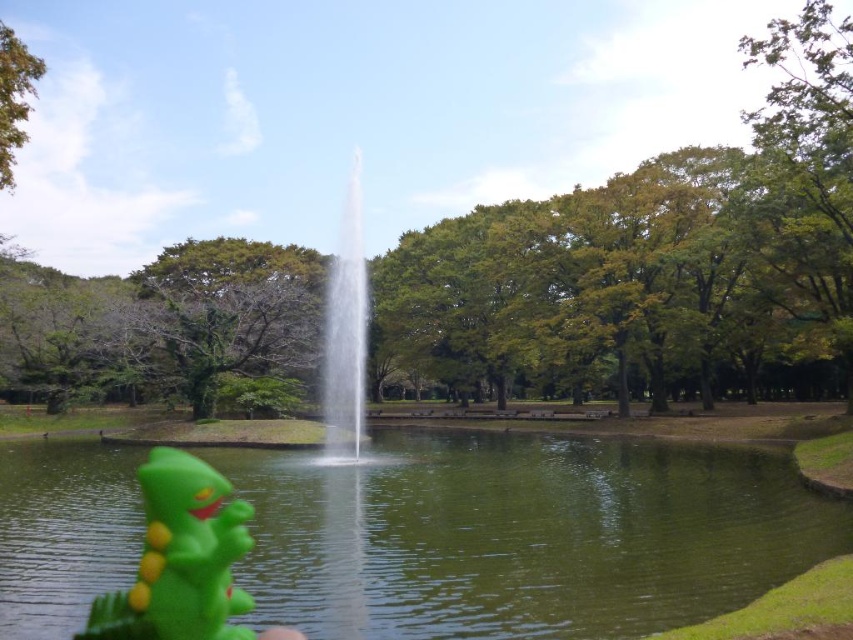
You are a photographer trying to capture the fountain in the park. You notice two points in your viewfinder at coordinates point (415, 444) and point (341, 451). Which point is closer to your camera lens?

Point (415, 444) is further to the camera than point (341, 451), so the point closer to your camera lens is point (341, 451).

You are a photographer standing in the park scene. You want to take a photo of the green rubber water at center without the green rubber toy at lower left being visible in the frame. Is this possible based on their positions?

The green rubber toy at lower left is behind the green rubber water at center, so it is obscured from view. Therefore, you can take a photo of the green rubber water at center without the green rubber toy at lower left being visible.